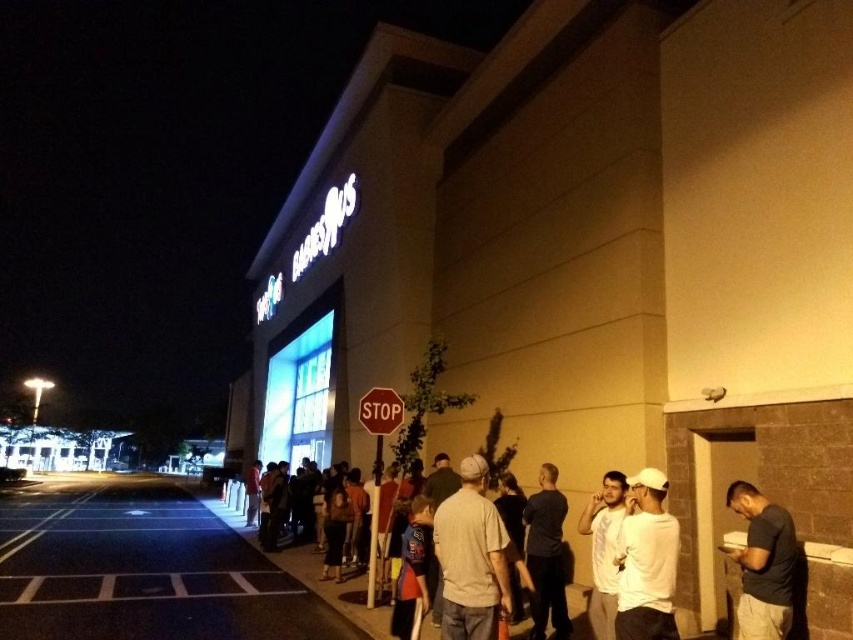
Is point (544, 476) positioned before point (421, 509)?

That is False.

From the picture: Does dark gray shirt at center have a lesser height compared to dark blue t-shirt at center?

No.

Is point (544, 541) less distant than point (416, 609)?

No.

This screenshot has height=640, width=853. In order to click on dark gray shirt at center in this screenshot , I will do `click(546, 556)`.

Is white matte shirt at center to the right of dark gray shirt at center from the viewer's perspective?

Yes, white matte shirt at center is to the right of dark gray shirt at center.

The width and height of the screenshot is (853, 640). Identify the location of white matte shirt at center. (646, 561).

Where is `white matte shirt at center`? The width and height of the screenshot is (853, 640). white matte shirt at center is located at coordinates (646, 561).

Based on the photo, who is lower down, black matte shirt at lower right or white cotton shirt at center?

white cotton shirt at center is lower down.

Which is in front, point (730, 556) or point (590, 608)?

Point (730, 556) is in front.

Where is `black matte shirt at lower right`? This screenshot has width=853, height=640. black matte shirt at lower right is located at coordinates (763, 563).

In order to click on black matte shirt at lower right in this screenshot , I will do `click(763, 563)`.